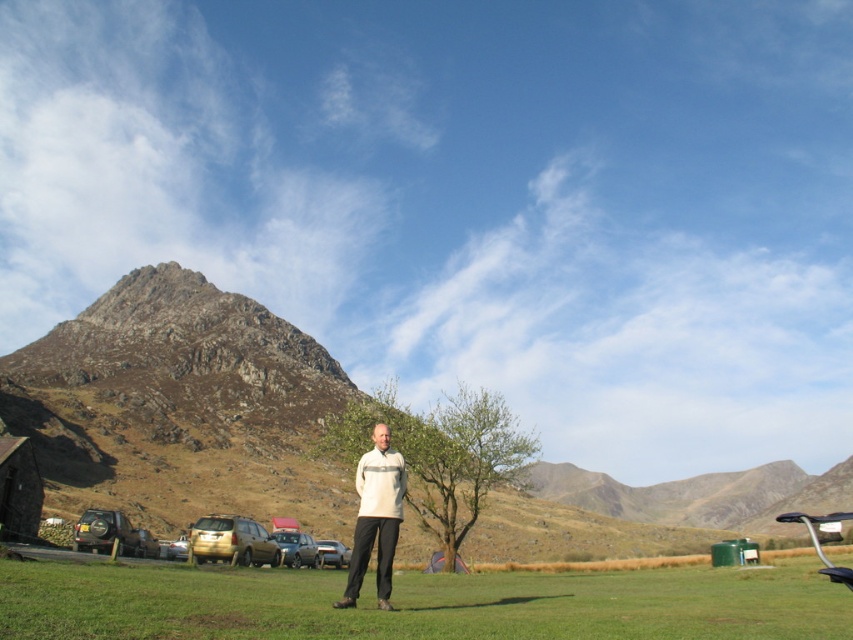
Question: In this image, where is rugged stone mountain at center located relative to gold metallic suv at lower left?

Choices:
 (A) left
 (B) right

Answer: (B)

Question: Considering the real-world distances, which object is farthest from the green grass at lower center?

Choices:
 (A) metallic silver car at center
 (B) metallic silver car at lower center
 (C) metallic gold suv at lower left
 (D) light beige sweater at center

Answer: (B)

Question: Can you confirm if light beige sweater at center is wider than metallic gold suv at lower left?

Choices:
 (A) no
 (B) yes

Answer: (A)

Question: Which point is closer to the camera?

Choices:
 (A) rugged stone mountain at center
 (B) metallic gold suv at lower left
 (C) metallic silver car at lower center

Answer: (B)

Question: Which of the following is the farthest from the observer?

Choices:
 (A) metallic gold suv at lower left
 (B) metallic silver car at center
 (C) light beige sweater at center
 (D) metallic silver car at lower center

Answer: (D)

Question: Can you confirm if rugged stone mountain at center is positioned to the right of metallic silver car at center?

Choices:
 (A) no
 (B) yes

Answer: (B)